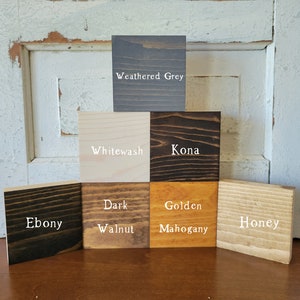
In order to click on shiny wooden floor in this screenshot , I will do `click(13, 286)`, `click(277, 293)`, `click(295, 255)`, `click(143, 263)`, `click(142, 293)`, `click(2, 245)`.